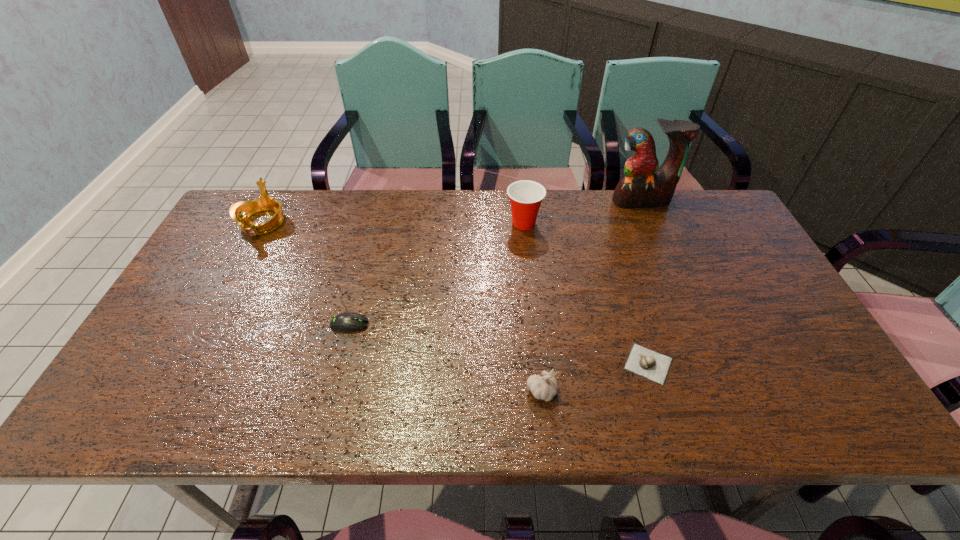
This screenshot has height=540, width=960. In the image, there is a desktop. In order to click on vacant area at the near right corner in this screenshot , I will do `click(778, 402)`.

This screenshot has width=960, height=540. Identify the location of free spot between the cup and the fourth farthest object. (437, 274).

Identify the location of blank region between the shortest object and the tiara. (455, 293).

Identify the location of vacant area between the tallest object and the cup. (583, 212).

In order to click on empty location between the computer mouse and the cup in this screenshot , I will do `click(437, 274)`.

The height and width of the screenshot is (540, 960). Identify the location of free space between the tallest object and the fifth object from right to left. (495, 263).

Image resolution: width=960 pixels, height=540 pixels. I want to click on unoccupied position between the fourth farthest object and the tiara, so click(x=306, y=274).

This screenshot has width=960, height=540. I want to click on free point between the taller garlic and the second shortest object, so click(445, 358).

Where is `vacant region between the leftmost object and the computer mouse`? This screenshot has width=960, height=540. vacant region between the leftmost object and the computer mouse is located at coordinates (306, 274).

Identify the location of free space between the third shortest object and the leftmost object. (x=402, y=307).